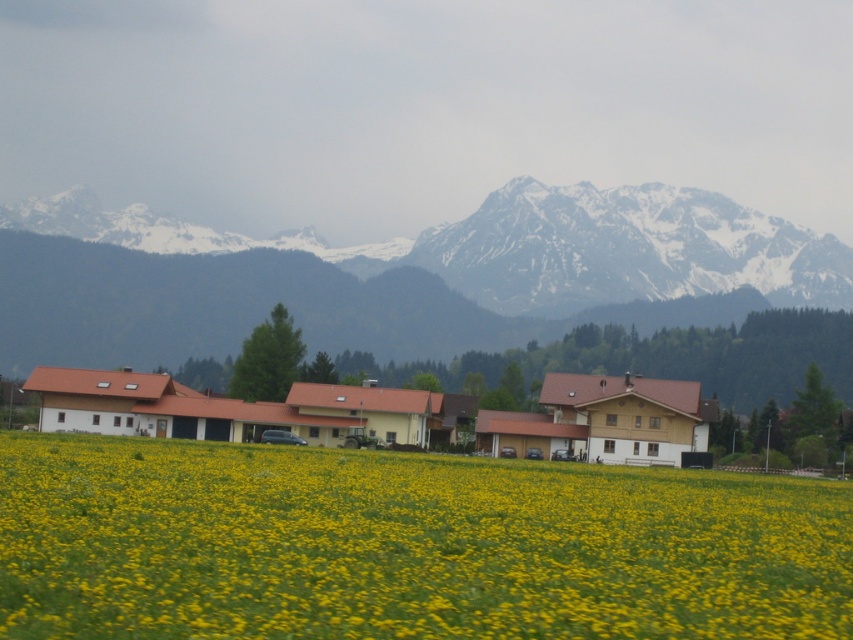
Question: Which point is farther to the camera?

Choices:
 (A) (389, 588)
 (B) (158, 260)

Answer: (B)

Question: Is yellow grass at center positioned before snowy rock mountain range at upper center?

Choices:
 (A) yes
 (B) no

Answer: (A)

Question: Does yellow grass at center have a lesser width compared to snowy rock mountain range at upper center?

Choices:
 (A) yes
 (B) no

Answer: (A)

Question: From the image, what is the correct spatial relationship of yellow grass at center in relation to snowy rock mountain range at upper center?

Choices:
 (A) left
 (B) right

Answer: (B)

Question: Which object is closer to the camera taking this photo?

Choices:
 (A) yellow grass at center
 (B) snowy rock mountain range at upper center

Answer: (A)